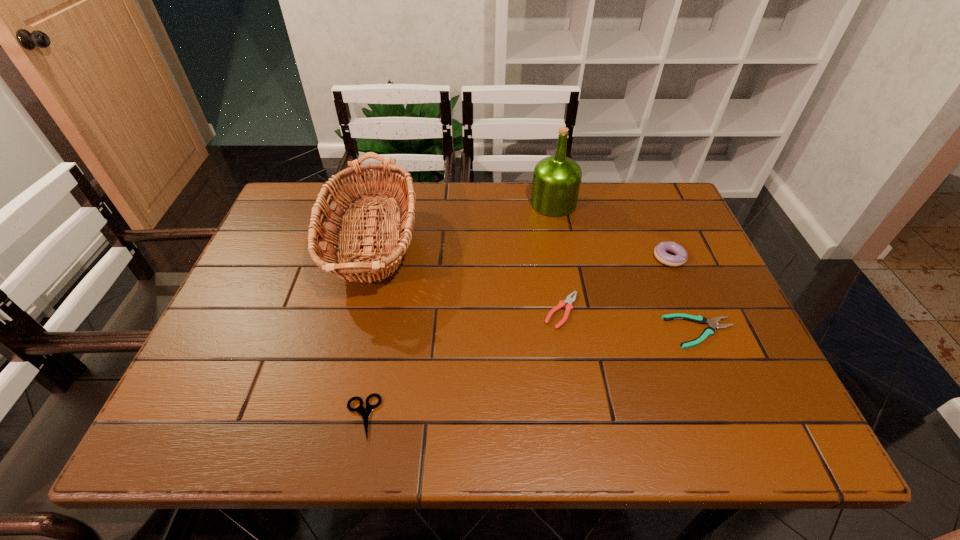
The image size is (960, 540). Identify the location of vacant space situated 0.290m on the back of the shorter pliers. (659, 234).

Find the location of a particular element. free space located 0.130m on the left of the shears is located at coordinates pos(277,417).

I want to click on olive oil that is at the far edge, so click(x=556, y=179).

Find the location of a particular element. basket located at the far edge is located at coordinates (348, 262).

Locate an element on the screen. This screenshot has width=960, height=540. object situated at the near edge is located at coordinates (364, 412).

Where is `object situated at the left edge`? object situated at the left edge is located at coordinates (348, 262).

In order to click on doughnut positioned at the right edge in this screenshot , I will do `click(660, 251)`.

In order to click on pliers at the right edge in this screenshot , I will do `click(712, 323)`.

At what (x,y) coordinates should I click in order to perform the action: click on object located at the far left corner. Please return your answer as a coordinate pair (x, y). The height and width of the screenshot is (540, 960). Looking at the image, I should click on (348, 262).

Locate an element on the screen. This screenshot has height=540, width=960. free space at the far edge of the desktop is located at coordinates (474, 210).